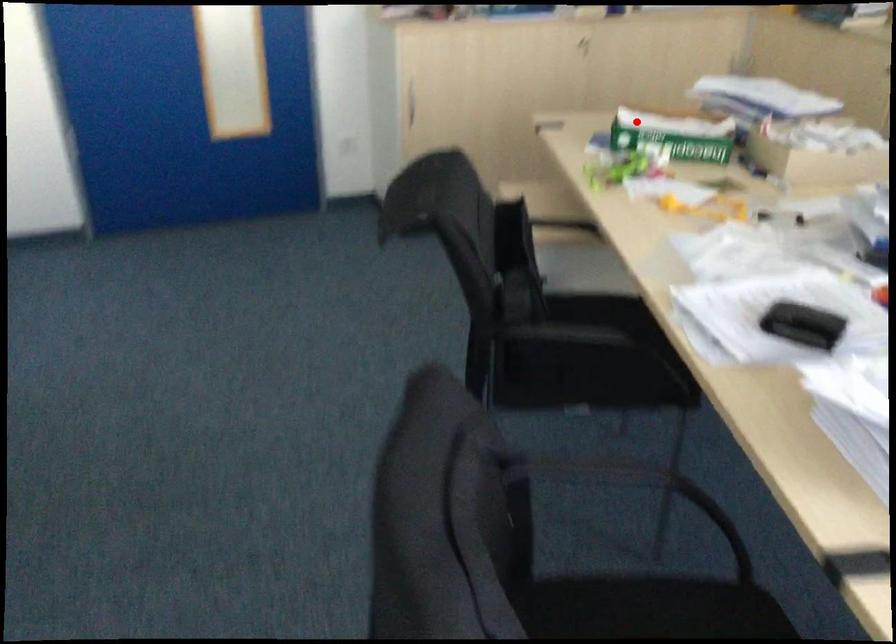
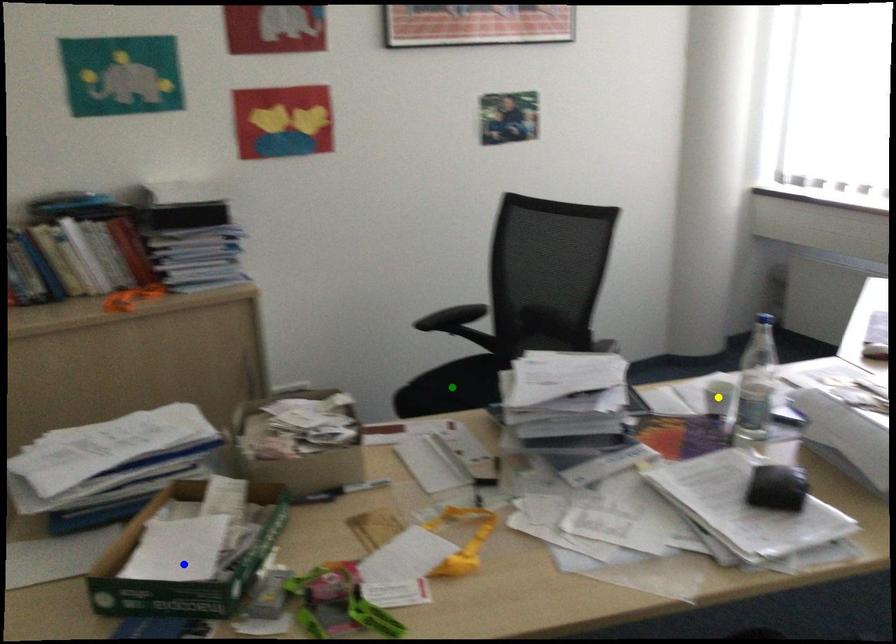
Question: I am providing you with two images of the same scene from different viewpoints. A red point is marked on the first image. You are given multiple points on the second image. Can you choose the point in image 2 that corresponds to the point in image 1?

Choices:
 (A) blue point
 (B) yellow point
 (C) green point

Answer: (A)